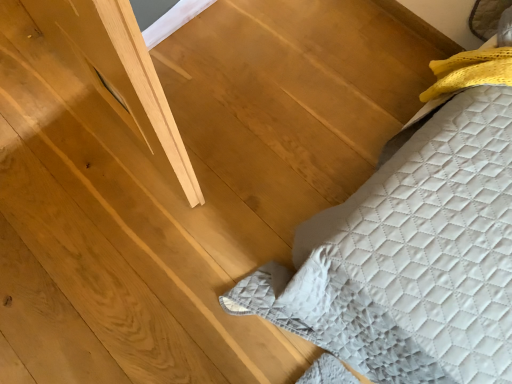
What are the coordinates of `matte gray window at upper left` in the screenshot? It's located at (165, 17).

What do you see at coordinates (165, 17) in the screenshot?
I see `matte gray window at upper left` at bounding box center [165, 17].

Where is `quilted fabric bed at lower right`? The width and height of the screenshot is (512, 384). quilted fabric bed at lower right is located at coordinates (414, 243).

The height and width of the screenshot is (384, 512). What do you see at coordinates (414, 243) in the screenshot? I see `quilted fabric bed at lower right` at bounding box center [414, 243].

In order to face quilted fabric bed at lower right, should I rotate leftwards or rightwards?

It's best to rotate left around 5.850 degrees.

Where is `matte gray window at upper left`? matte gray window at upper left is located at coordinates (165, 17).

Can you confirm if matte gray window at upper left is positioned to the right of quilted fabric bed at lower right?

In fact, matte gray window at upper left is to the left of quilted fabric bed at lower right.

Is matte gray window at upper left behind quilted fabric bed at lower right?

Yes, matte gray window at upper left is behind quilted fabric bed at lower right.

Does point (167, 14) come in front of point (295, 260)?

No, (167, 14) is behind (295, 260).

From the image's perspective, is matte gray window at upper left under quilted fabric bed at lower right?

No, from the image's perspective, matte gray window at upper left is not below quilted fabric bed at lower right.

From a real-world perspective, which is physically above, matte gray window at upper left or quilted fabric bed at lower right?

matte gray window at upper left.

Does matte gray window at upper left have a lesser width compared to quilted fabric bed at lower right?

Yes, matte gray window at upper left is thinner than quilted fabric bed at lower right.

Can you confirm if matte gray window at upper left is shorter than quilted fabric bed at lower right?

Incorrect, the height of matte gray window at upper left does not fall short of that of quilted fabric bed at lower right.

Between matte gray window at upper left and quilted fabric bed at lower right, which one has smaller size?

With smaller size is matte gray window at upper left.

Could quilted fabric bed at lower right be considered to be inside matte gray window at upper left?

Definitely not — quilted fabric bed at lower right is not inside matte gray window at upper left.

Does matte gray window at upper left touch quilted fabric bed at lower right?

No, matte gray window at upper left is not beside quilted fabric bed at lower right.

Is matte gray window at upper left aimed at quilted fabric bed at lower right?

No, matte gray window at upper left is not oriented towards quilted fabric bed at lower right.

How distant is matte gray window at upper left from quilted fabric bed at lower right?

3.36 feet.

Image resolution: width=512 pixels, height=384 pixels. Find the location of `window that appears above the quilted fabric bed at lower right (from a real-world perspective)`. window that appears above the quilted fabric bed at lower right (from a real-world perspective) is located at coordinates (165, 17).

Which is more to the left, quilted fabric bed at lower right or matte gray window at upper left?

Positioned to the left is matte gray window at upper left.

From the picture: Which object is further away from the camera, quilted fabric bed at lower right or matte gray window at upper left?

matte gray window at upper left.

Between point (419, 209) and point (175, 26), which one is positioned behind?

The point (175, 26) is farther from the camera.

From the image's perspective, between quilted fabric bed at lower right and matte gray window at upper left, which one is located above?

matte gray window at upper left.

From a real-world perspective, who is located lower, quilted fabric bed at lower right or matte gray window at upper left?

quilted fabric bed at lower right is physically lower.

Considering the sizes of objects quilted fabric bed at lower right and matte gray window at upper left in the image provided, who is thinner, quilted fabric bed at lower right or matte gray window at upper left?

Thinner between the two is matte gray window at upper left.

Considering the sizes of objects quilted fabric bed at lower right and matte gray window at upper left in the image provided, who is shorter, quilted fabric bed at lower right or matte gray window at upper left?

quilted fabric bed at lower right.

Does quilted fabric bed at lower right have a larger size compared to matte gray window at upper left?

Correct, quilted fabric bed at lower right is larger in size than matte gray window at upper left.

Is quilted fabric bed at lower right inside or outside of matte gray window at upper left?

quilted fabric bed at lower right is not enclosed by matte gray window at upper left.

In the scene shown: Is quilted fabric bed at lower right positioned far away from matte gray window at upper left?

Yes, quilted fabric bed at lower right is far from matte gray window at upper left.

Is quilted fabric bed at lower right positioned with its back to matte gray window at upper left?

quilted fabric bed at lower right does not have its back to matte gray window at upper left.

Identify the location of furniture lying in front of the matte gray window at upper left. The width and height of the screenshot is (512, 384). (414, 243).

Find the location of `window to the left of quilted fabric bed at lower right`. window to the left of quilted fabric bed at lower right is located at coordinates (165, 17).

Image resolution: width=512 pixels, height=384 pixels. In order to click on window positioned vertically above the quilted fabric bed at lower right (from a real-world perspective) in this screenshot , I will do `click(165, 17)`.